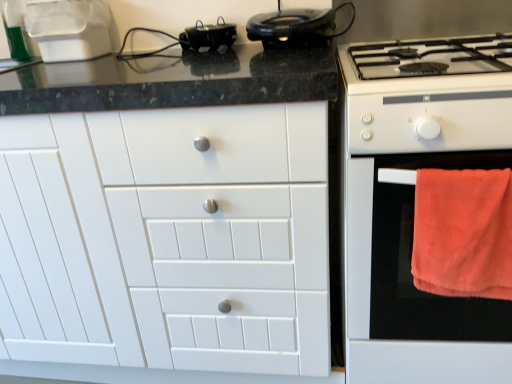
Question: Is there a large distance between orange soft towel at right and shiny black steering wheel at upper center?

Choices:
 (A) no
 (B) yes

Answer: (A)

Question: Is orange soft towel at right shorter than shiny black steering wheel at upper center?

Choices:
 (A) no
 (B) yes

Answer: (A)

Question: Is shiny black steering wheel at upper center inside orange soft towel at right?

Choices:
 (A) yes
 (B) no

Answer: (B)

Question: Is orange soft towel at right at the right side of shiny black steering wheel at upper center?

Choices:
 (A) no
 (B) yes

Answer: (B)

Question: Is orange soft towel at right behind shiny black steering wheel at upper center?

Choices:
 (A) no
 (B) yes

Answer: (A)

Question: From a real-world perspective, is shiny black steering wheel at upper center physically located above or below black glossy pot at upper center?

Choices:
 (A) above
 (B) below

Answer: (A)

Question: Considering the positions of point (245, 26) and point (224, 39), is point (245, 26) closer or farther from the camera than point (224, 39)?

Choices:
 (A) farther
 (B) closer

Answer: (A)

Question: Considering the positions of shiny black steering wheel at upper center and black glossy pot at upper center in the image, is shiny black steering wheel at upper center bigger or smaller than black glossy pot at upper center?

Choices:
 (A) big
 (B) small

Answer: (A)

Question: From their relative heights in the image, would you say shiny black steering wheel at upper center is taller or shorter than black glossy pot at upper center?

Choices:
 (A) short
 (B) tall

Answer: (B)

Question: Considering the positions of shiny black steering wheel at upper center and white matte cabinet at center in the image, is shiny black steering wheel at upper center bigger or smaller than white matte cabinet at center?

Choices:
 (A) big
 (B) small

Answer: (B)

Question: Relative to white matte cabinet at center, is shiny black steering wheel at upper center in front or behind?

Choices:
 (A) behind
 (B) front

Answer: (A)

Question: From a real-world perspective, is shiny black steering wheel at upper center above or below white matte cabinet at center?

Choices:
 (A) below
 (B) above

Answer: (B)

Question: From their relative heights in the image, would you say shiny black steering wheel at upper center is taller or shorter than white matte cabinet at center?

Choices:
 (A) short
 (B) tall

Answer: (A)

Question: Which is correct: white glossy gas stove at right is inside white matte cabinet at center, or outside of it?

Choices:
 (A) inside
 (B) outside

Answer: (B)

Question: Considering the positions of white glossy gas stove at right and white matte cabinet at center in the image, is white glossy gas stove at right wider or thinner than white matte cabinet at center?

Choices:
 (A) wide
 (B) thin

Answer: (A)